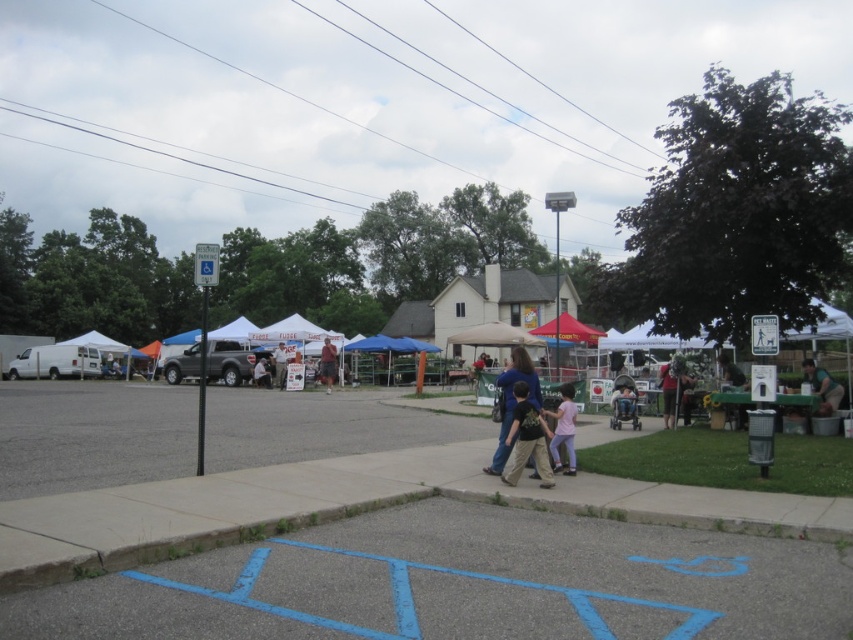
You are standing at the point marked by the coordinates point (672, 387) in the image. What is the nearest object to you?

The nearest object to you is the matte green shirt at center, as the point (672, 387) marks its location.

You are a customer at the outdoor market and see both the blue denim jeans at center and the khaki cotton shorts at center displayed on a rack. Which item is located to the right when facing the rack?

The blue denim jeans at center is positioned on the right side of khaki cotton shorts at center, so it is located to the right when facing the rack.

You are a photographer standing at the edge of the market. You want to take a photo of the matte green shirt at center and the khaki cotton shorts at center. Which object should you focus on first to ensure both are in sharp focus?

You should focus on the matte green shirt at center first since it is closer to the viewer than the khaki cotton shorts at center, ensuring both will be in focus when using proper depth of field.